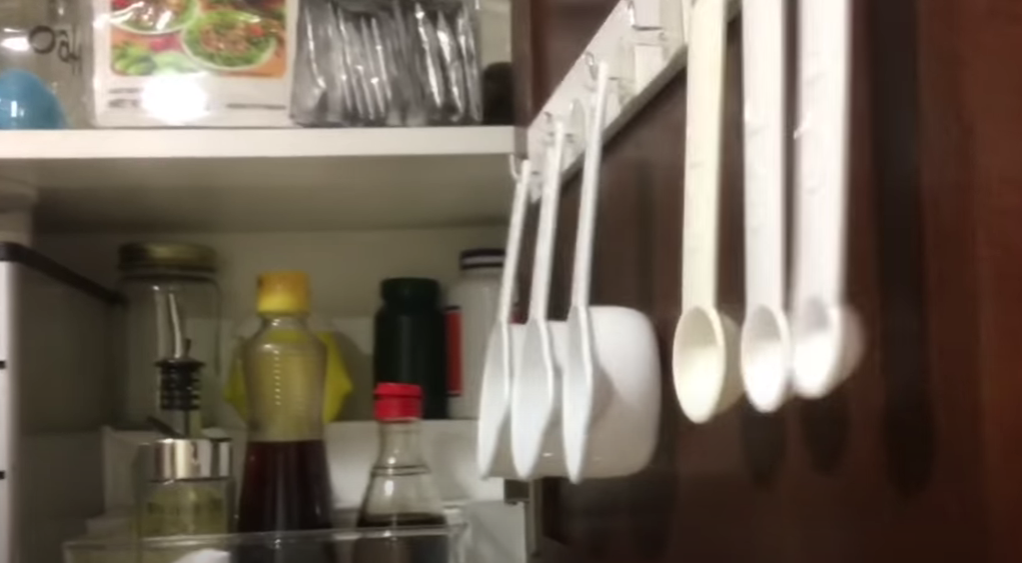
Where is `white top cupboard shelf`? white top cupboard shelf is located at coordinates (247, 150).